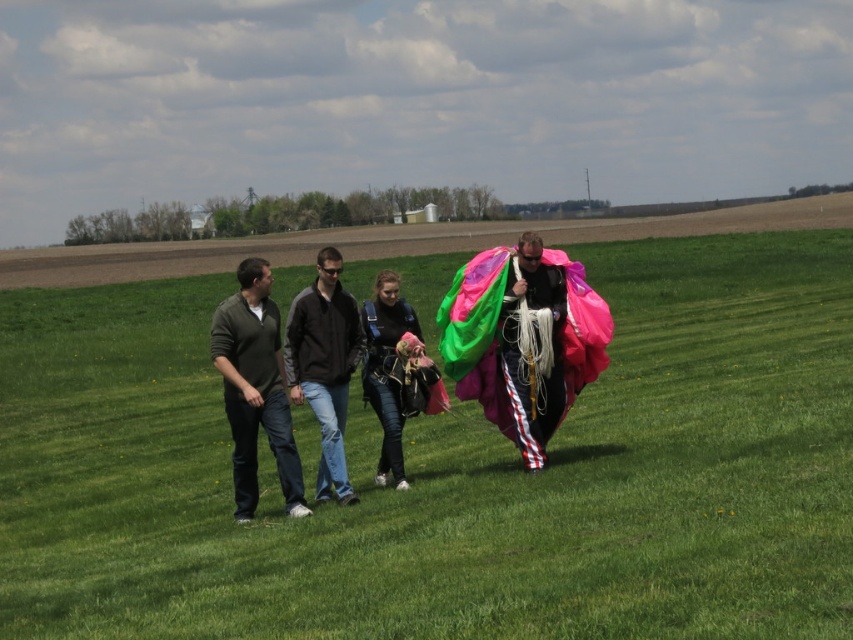
Between green grass field at center and black jacket at center, which one appears on the left side from the viewer's perspective?

From the viewer's perspective, green grass field at center appears more on the left side.

Is the position of green grass field at center less distant than that of black jacket at center?

Yes, it is in front of black jacket at center.

Is point (158, 497) positioned behind point (354, 317)?

Yes, point (158, 497) is behind point (354, 317).

Find the location of a particular element. Image resolution: width=853 pixels, height=640 pixels. green grass field at center is located at coordinates (450, 472).

Can you confirm if multicolored fabric parachute at center is bigger than denim jacket at center?

Yes, multicolored fabric parachute at center is bigger than denim jacket at center.

Where is `multicolored fabric parachute at center`? This screenshot has height=640, width=853. multicolored fabric parachute at center is located at coordinates (523, 339).

Who is taller, green grass field at center or green matte shirt at left?

With more height is green grass field at center.

Between green grass field at center and green matte shirt at left, which one is positioned higher?

green grass field at center is higher up.

Is point (851, 298) less distant than point (293, 456)?

No, (851, 298) is behind (293, 456).

Where is `green grass field at center`? Image resolution: width=853 pixels, height=640 pixels. green grass field at center is located at coordinates (450, 472).